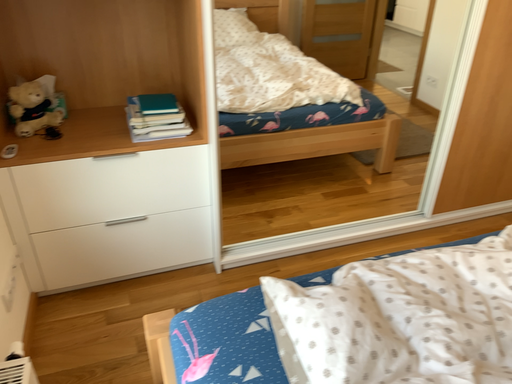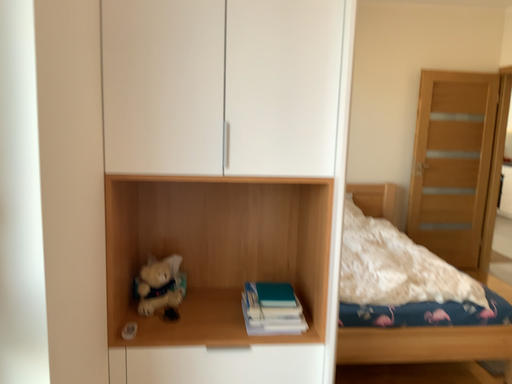
Question: How did the camera likely rotate when shooting the video?

Choices:
 (A) rotated right
 (B) rotated left

Answer: (B)